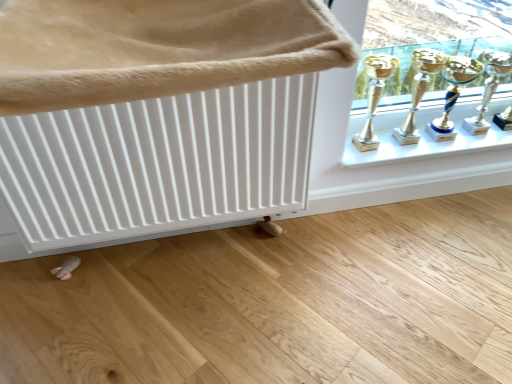
Where is `free space on the front side of white matte radiator at upper left`? Image resolution: width=512 pixels, height=384 pixels. free space on the front side of white matte radiator at upper left is located at coordinates (187, 317).